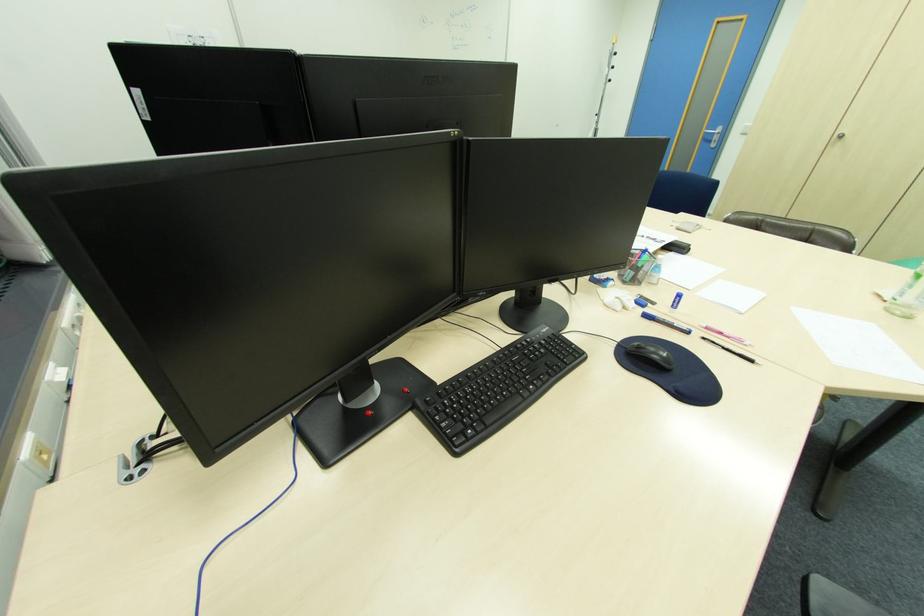
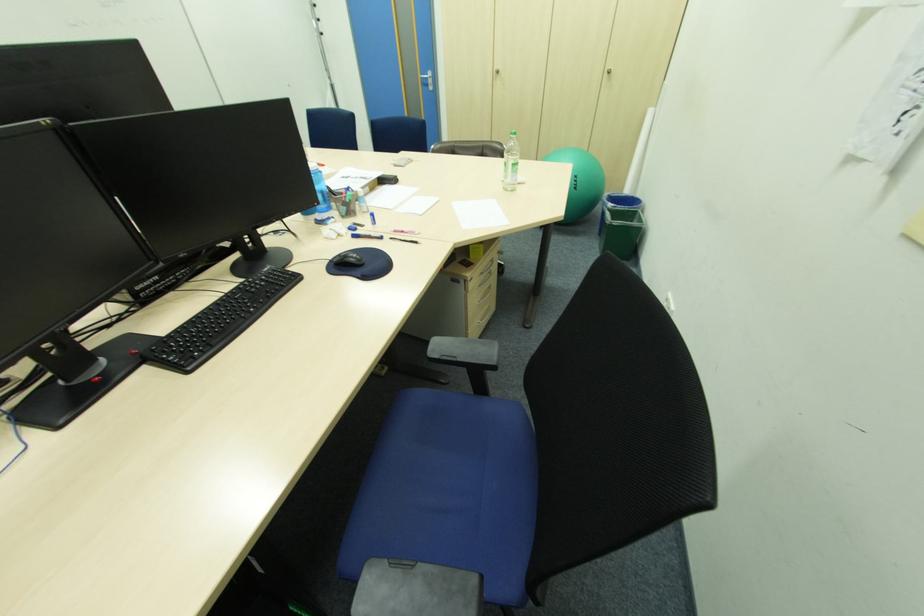
In the second image, find the point that corresponds to (657,284) in the first image.

(370, 213)